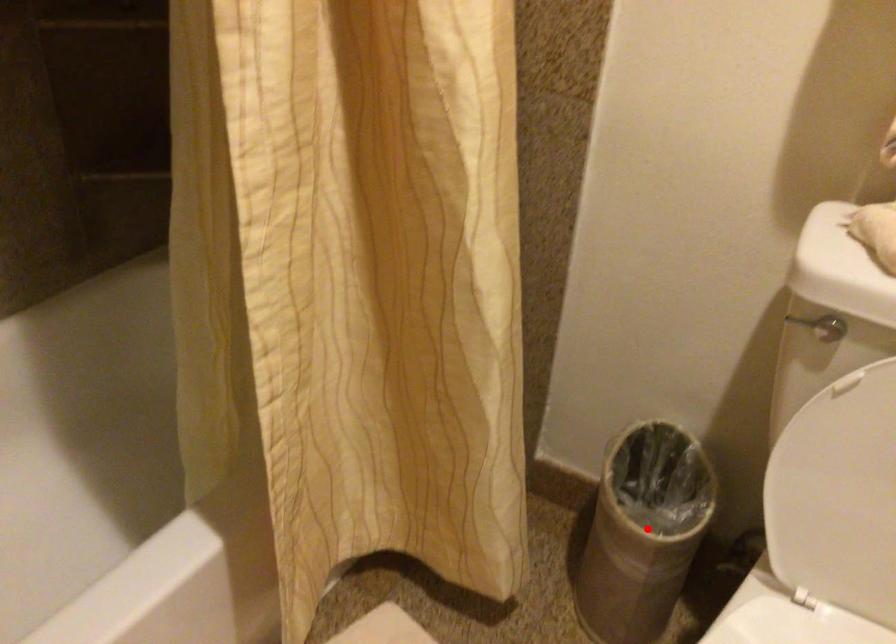
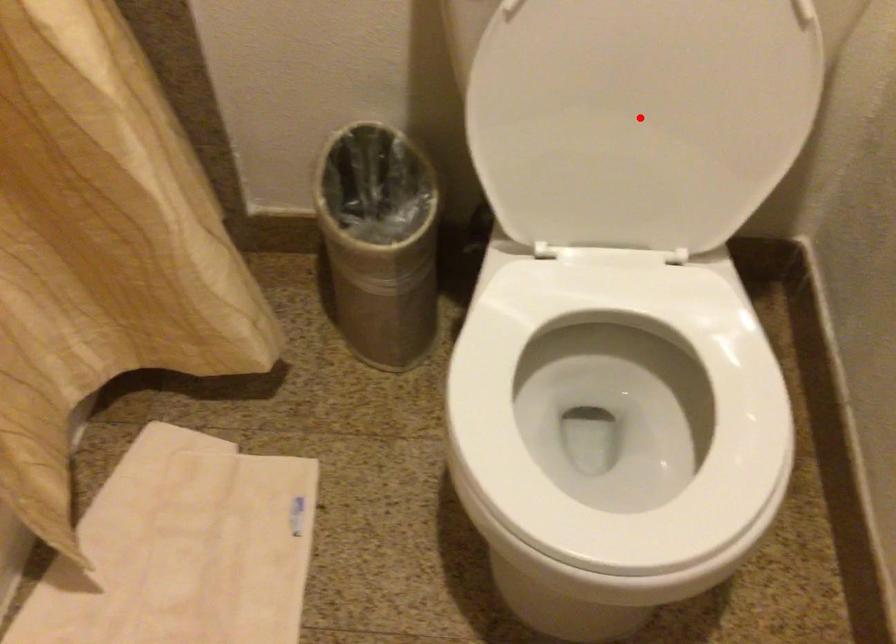
I am providing you with two images of the same scene from different viewpoints. A red point is marked on the first image and another point is marked on the second image. Is the marked point in image1 the same physical position as the marked point in image2?

No